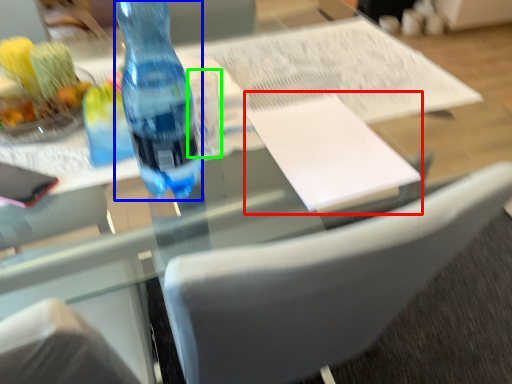
Question: Based on their relative distances, which object is nearer to journal (highlighted by a red box)? Choose from bottle (highlighted by a blue box) and clear (highlighted by a green box).

Choices:
 (A) bottle
 (B) clear

Answer: (B)